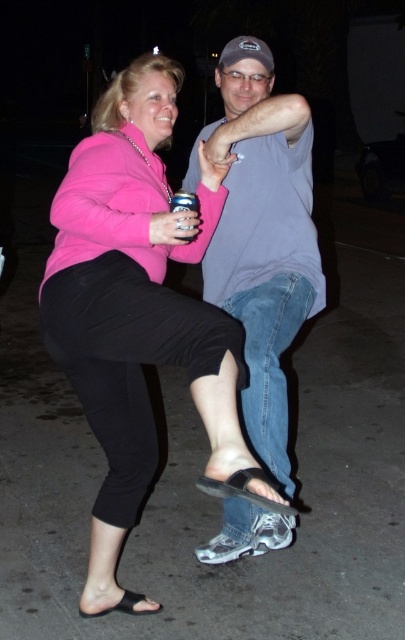
Is pink matte jacket at upper left below gray cotton t-shirt at upper center?

Yes.

Does pink matte jacket at upper left have a greater width compared to gray cotton t-shirt at upper center?

Yes.

Locate an element on the screen. This screenshot has width=405, height=640. pink matte jacket at upper left is located at coordinates (138, 308).